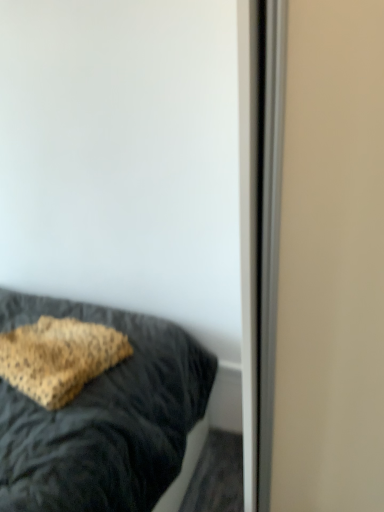
Where is `vacant region above leopard print fabric pillow at lower left (from a real-world perspective)`? This screenshot has width=384, height=512. vacant region above leopard print fabric pillow at lower left (from a real-world perspective) is located at coordinates (53, 335).